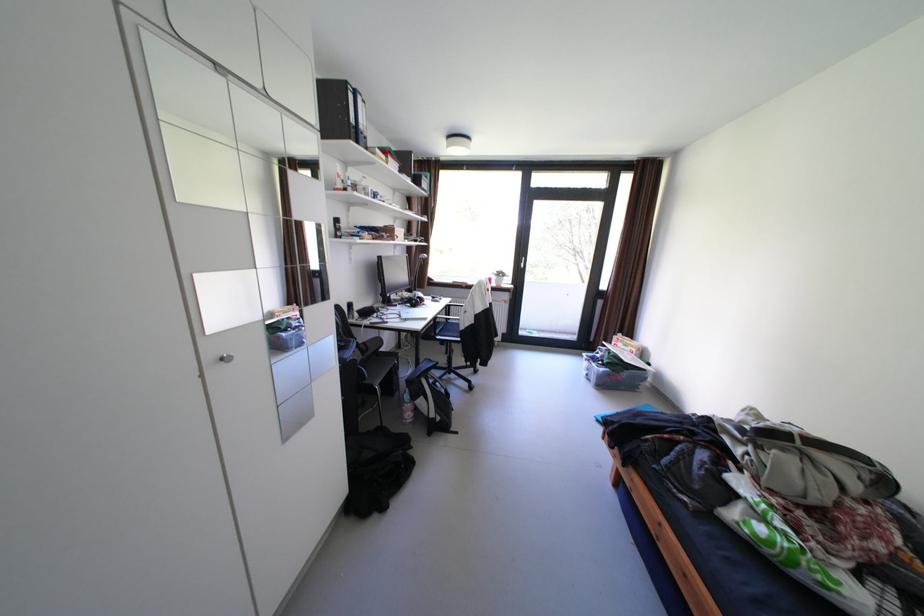
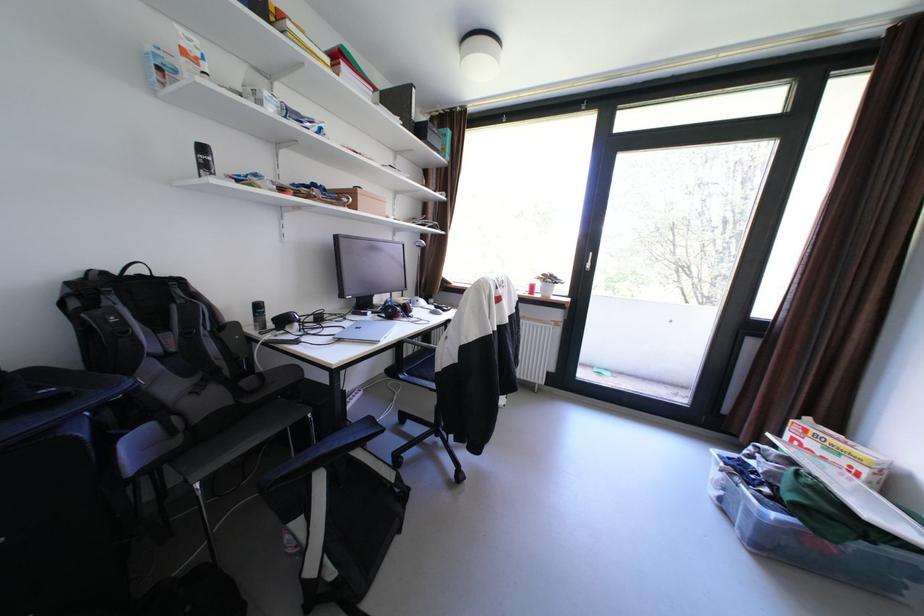
In the second image, find the point that corresponds to pixel 612 370 in the first image.

(784, 516)